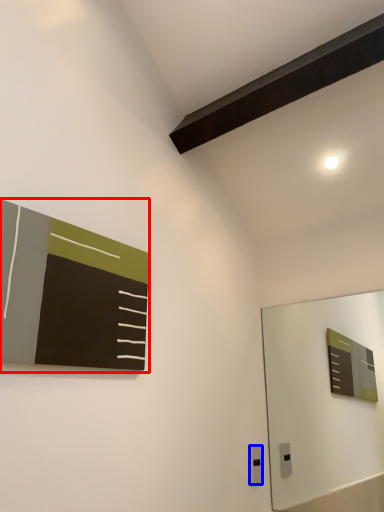
Question: Which point is further to the camera, bulletin board (highlighted by a red box) or electric outlet (highlighted by a blue box)?

Choices:
 (A) bulletin board
 (B) electric outlet

Answer: (B)